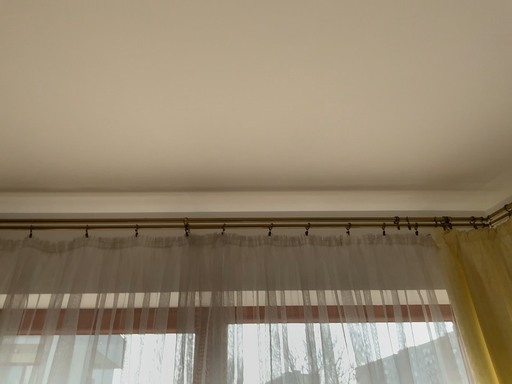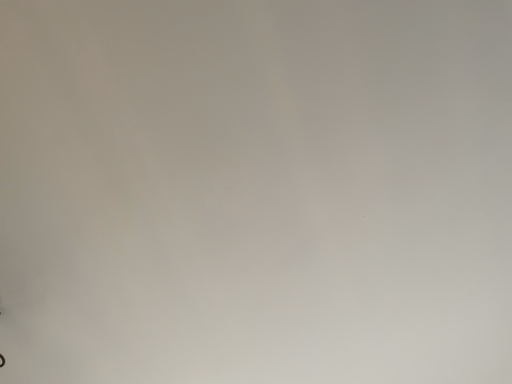
Question: How did the camera likely rotate when shooting the video?

Choices:
 (A) rotated downward
 (B) rotated upward

Answer: (B)